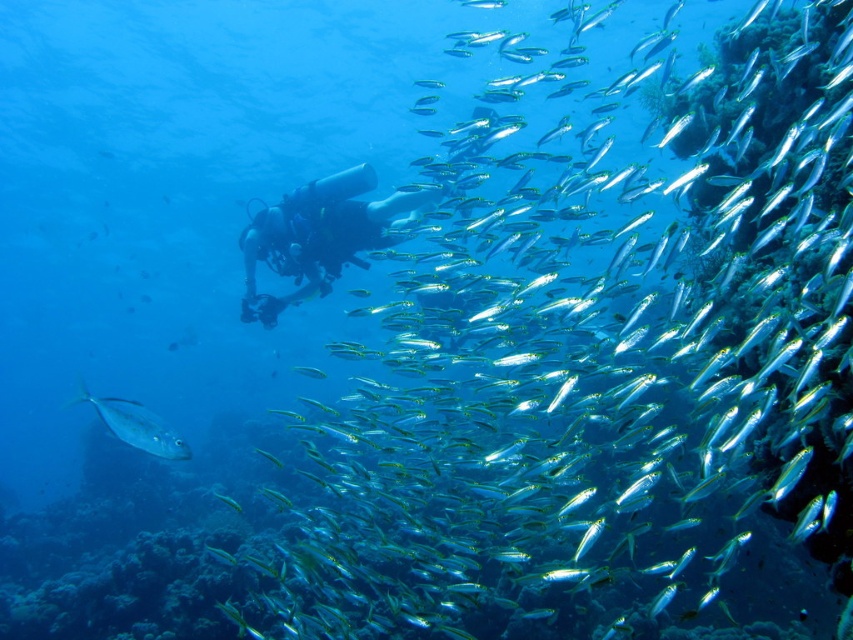
You are a marine biologist studying underwater life. You observe a black matte scuba diver at center and a shiny silver fish at lower left in the scene. Based on their sizes, which one is larger?

The black matte scuba diver at center is taller than the shiny silver fish at lower left, so the diver is larger in size.

You are a marine biologist studying underwater life. You notice the black matte scuba diver at center and the shiny silver fish at lower left. Based on their sizes, which one would cast a bigger shadow in the water?

The black matte scuba diver at center is larger than the shiny silver fish at lower left, so it would cast a bigger shadow in the water.